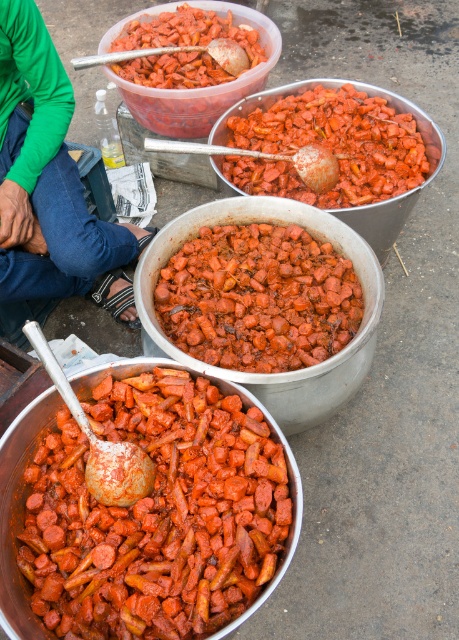
Question: Which object appears farthest from the camera in this image?

Choices:
 (A) shiny red carrot at bottom left
 (B) glossy red carrot at center
 (C) matte plastic carrots at center

Answer: (C)

Question: Considering the relative positions of shiny red carrot at bottom left and glossy red carrot at center in the image provided, where is shiny red carrot at bottom left located with respect to glossy red carrot at center?

Choices:
 (A) above
 (B) below

Answer: (B)

Question: Can you confirm if shiny red carrot at bottom left is positioned above matte plastic carrots at center?

Choices:
 (A) yes
 (B) no

Answer: (B)

Question: Which point is farther from the camera taking this photo?

Choices:
 (A) (251, 348)
 (B) (167, 577)

Answer: (A)

Question: Can you confirm if shiny red carrot at bottom left is positioned above matte plastic carrots at center?

Choices:
 (A) yes
 (B) no

Answer: (B)

Question: Which point appears closest to the camera in this image?

Choices:
 (A) (325, 92)
 (B) (186, 349)

Answer: (B)